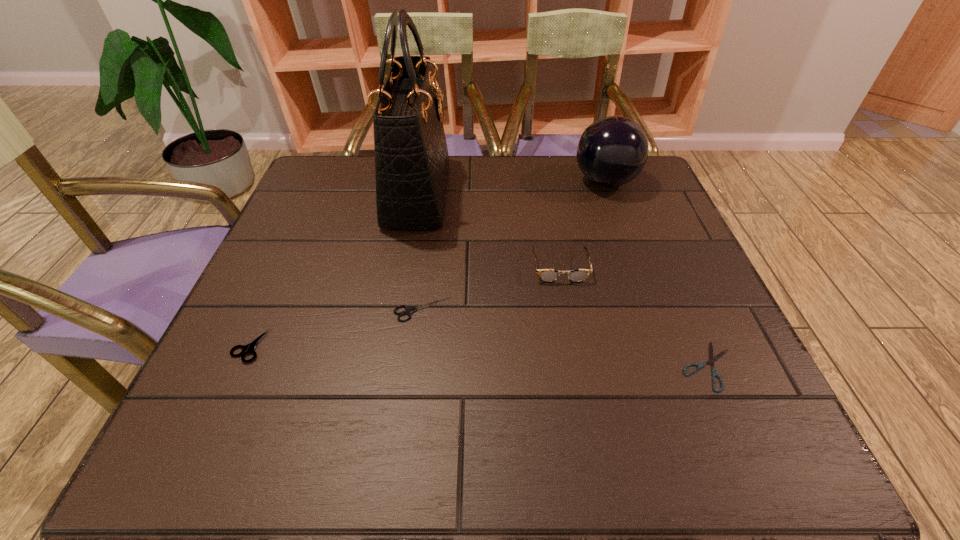
The height and width of the screenshot is (540, 960). What are the coordinates of `unoccupied position between the fifth shortest object and the fourth object from left to right` in the screenshot? It's located at (583, 225).

Image resolution: width=960 pixels, height=540 pixels. What are the coordinates of `object that is the second closest one to the fourth shortest object` in the screenshot? It's located at click(x=714, y=373).

Point out which object is positioned as the fourth nearest to the tallest object. Please provide its 2D coordinates. Your answer should be formatted as a tuple, i.e. [(x, y)], where the tuple contains the x and y coordinates of a point satisfying the conditions above.

[(612, 151)]

I want to click on the third closest shears relative to the handbag, so click(714, 373).

Where is `shears object that ranks as the closest to the shortest object`? shears object that ranks as the closest to the shortest object is located at coordinates (408, 311).

The height and width of the screenshot is (540, 960). I want to click on vacant space that satisfies the following two spatial constraints: 1. at the front of the second shears from left to right with visible charms; 2. on the right side of the handbag, so click(x=397, y=309).

Locate an element on the screen. The image size is (960, 540). free location that satisfies the following two spatial constraints: 1. at the front of the tallest object with visible charms; 2. on the front side of the tallest shears is located at coordinates (391, 346).

Identify the location of blank space that satisfies the following two spatial constraints: 1. on the side of the bowling ball with the finger holes; 2. on the frame of the spectacles. The height and width of the screenshot is (540, 960). (636, 267).

In order to click on free space that satisfies the following two spatial constraints: 1. on the side of the bowling ball with the finger holes; 2. on the right side of the shortest object in this screenshot , I will do click(x=672, y=366).

Where is `free space that satisfies the following two spatial constraints: 1. on the side of the bowling ball with the finger holes; 2. on the right side of the shortest object`? free space that satisfies the following two spatial constraints: 1. on the side of the bowling ball with the finger holes; 2. on the right side of the shortest object is located at coordinates (672, 366).